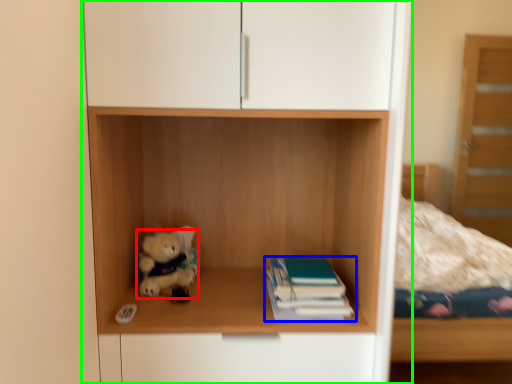
Question: Which is nearer to the teddy bear (highlighted by a red box)? book (highlighted by a blue box) or cupboard (highlighted by a green box).

Choices:
 (A) book
 (B) cupboard

Answer: (A)